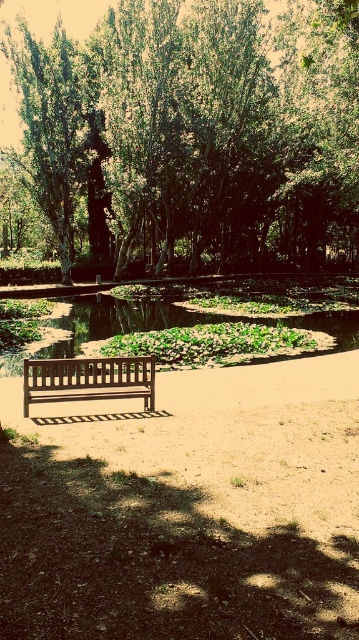
Question: Among these objects, which one is farthest from the camera?

Choices:
 (A) green leafy pond at center
 (B) green leafy tree at upper center

Answer: (A)

Question: Does green leafy tree at upper center have a lesser width compared to green leafy pond at center?

Choices:
 (A) yes
 (B) no

Answer: (B)

Question: Which of the following is the closest to the observer?

Choices:
 (A) green leafy tree at upper center
 (B) wooden bench at center

Answer: (B)

Question: Is green leafy tree at upper center wider than wooden bench at center?

Choices:
 (A) yes
 (B) no

Answer: (A)

Question: Is green leafy tree at upper center to the right of wooden bench at center from the viewer's perspective?

Choices:
 (A) yes
 (B) no

Answer: (A)

Question: Which point is farther from the camera taking this photo?

Choices:
 (A) 269,49
 (B) 34,384
 (C) 84,324

Answer: (A)